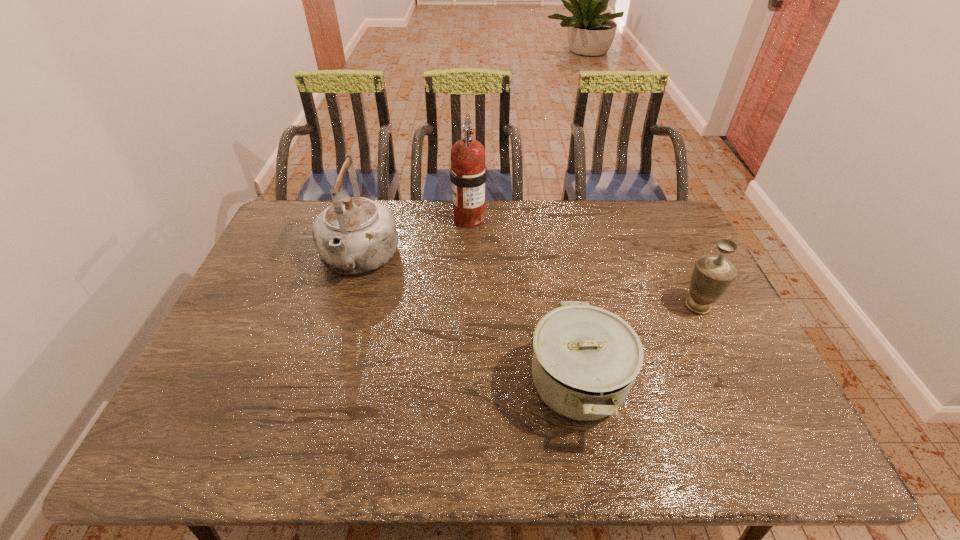
You are a GUI agent. You are given a task and a screenshot of the screen. Output one action in this format:
    pyautogui.click(x=<x>, y=<y>)
    Task: Click on the vacant region at the far left corner
    This screenshot has height=540, width=960.
    Given the screenshot: What is the action you would take?
    pyautogui.click(x=290, y=202)

Locate an element on the screen. vacant space at the far right corner is located at coordinates (642, 240).

You are a GUI agent. You are given a task and a screenshot of the screen. Output one action in this format:
    pyautogui.click(x=<x>, y=<y>)
    Task: Click on the unoccupied position between the third object from left to right and the third object from right to left
    This screenshot has height=540, width=960.
    Given the screenshot: What is the action you would take?
    pyautogui.click(x=523, y=301)

The height and width of the screenshot is (540, 960). What are the coordinates of `unoccupied position between the fire extinguisher and the nearest object` in the screenshot? It's located at (523, 301).

Where is `blank region between the second object from left to right and the second tallest object`? This screenshot has width=960, height=540. blank region between the second object from left to right and the second tallest object is located at coordinates (414, 239).

Where is `vacant area between the nearest object and the fire extinguisher`? This screenshot has height=540, width=960. vacant area between the nearest object and the fire extinguisher is located at coordinates (523, 301).

This screenshot has height=540, width=960. Find the location of `empty location between the fire extinguisher and the saucepan`. empty location between the fire extinguisher and the saucepan is located at coordinates (523, 301).

This screenshot has height=540, width=960. Identify the location of vacant area that lies between the second shortest object and the tallest object. (584, 262).

The height and width of the screenshot is (540, 960). I want to click on the second closest object to the shortest object, so click(x=355, y=235).

The width and height of the screenshot is (960, 540). I want to click on object identified as the closest to the third object from right to left, so click(x=355, y=235).